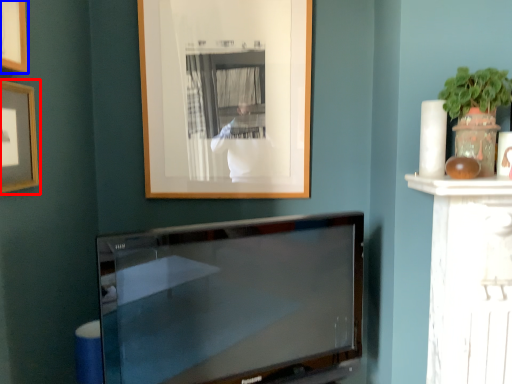
Question: Which of the following is the farthest to the observer, picture frame (highlighted by a red box) or picture frame (highlighted by a blue box)?

Choices:
 (A) picture frame
 (B) picture frame

Answer: (A)